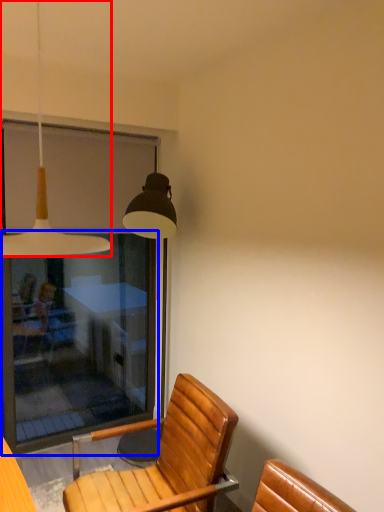
Question: Among these objects, which one is nearest to the camera, lamp (highlighted by a red box) or screen door (highlighted by a blue box)?

Choices:
 (A) lamp
 (B) screen door

Answer: (A)